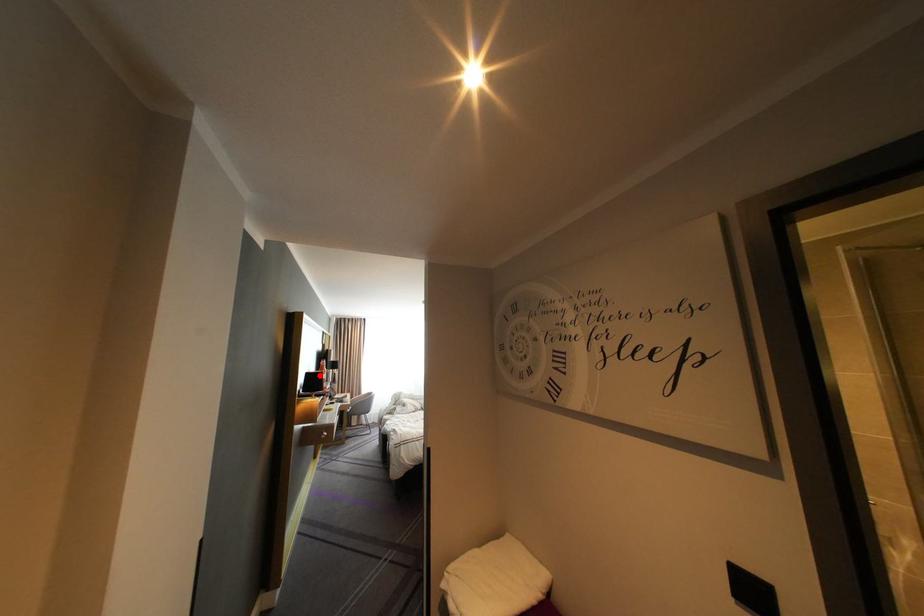
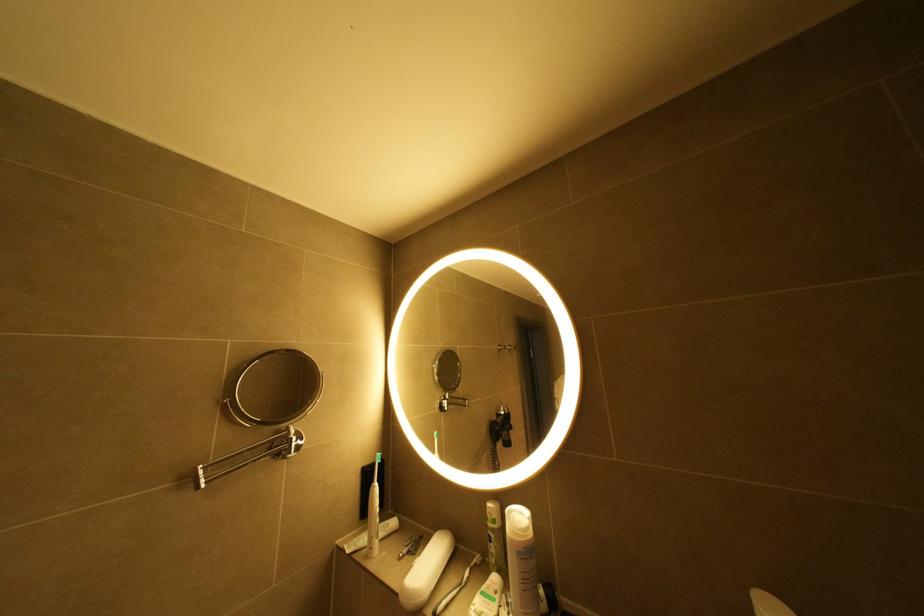
Question: I am providing you with two images of the same scene from different viewpoints. A red point is marked on the first image. Can you still see the location of the red point in image 2?

Choices:
 (A) Yes
 (B) No

Answer: (B)